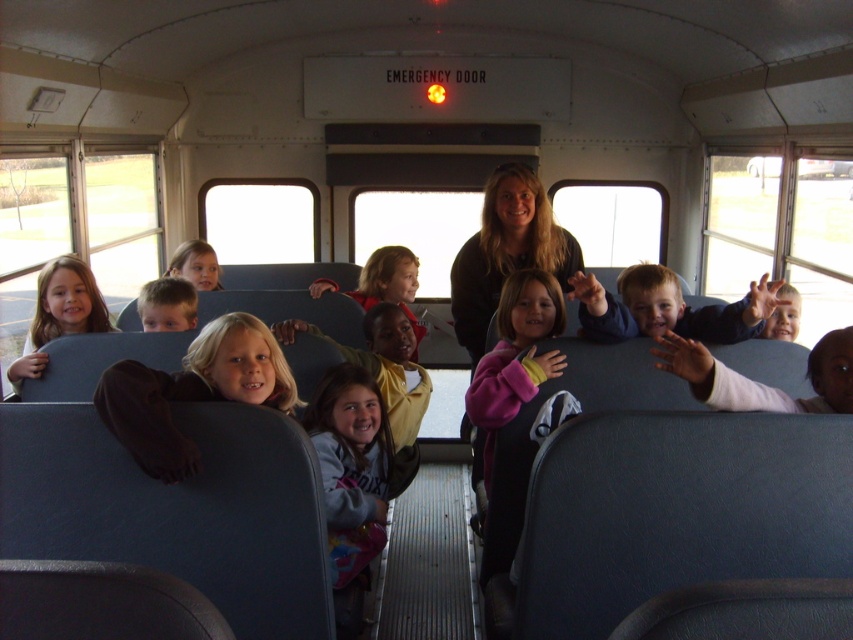
Question: Does gray fleece jacket at center appear on the left side of blonde hair at center?

Choices:
 (A) no
 (B) yes

Answer: (A)

Question: Can you confirm if smooth blue jacket at right is smaller than matte yellow jacket at center?

Choices:
 (A) yes
 (B) no

Answer: (A)

Question: Which object is the farthest from the blonde hair at upper left?

Choices:
 (A) matte yellow jacket at center
 (B) smooth black shirt at center

Answer: (B)

Question: Among these objects, which one is farthest from the camera?

Choices:
 (A) gray fleece jacket at center
 (B) matte blue jacket at center
 (C) blonde hair at upper left

Answer: (C)

Question: Is matte blond hair at left above blonde hair at upper left?

Choices:
 (A) no
 (B) yes

Answer: (A)

Question: Which of the following is the closest to the observer?

Choices:
 (A) (567, 237)
 (B) (45, 301)

Answer: (B)